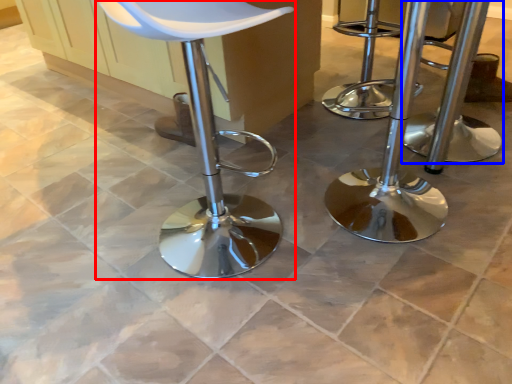
Question: Which object is closer to the camera taking this photo, chair (highlighted by a red box) or stool (highlighted by a blue box)?

Choices:
 (A) chair
 (B) stool

Answer: (A)